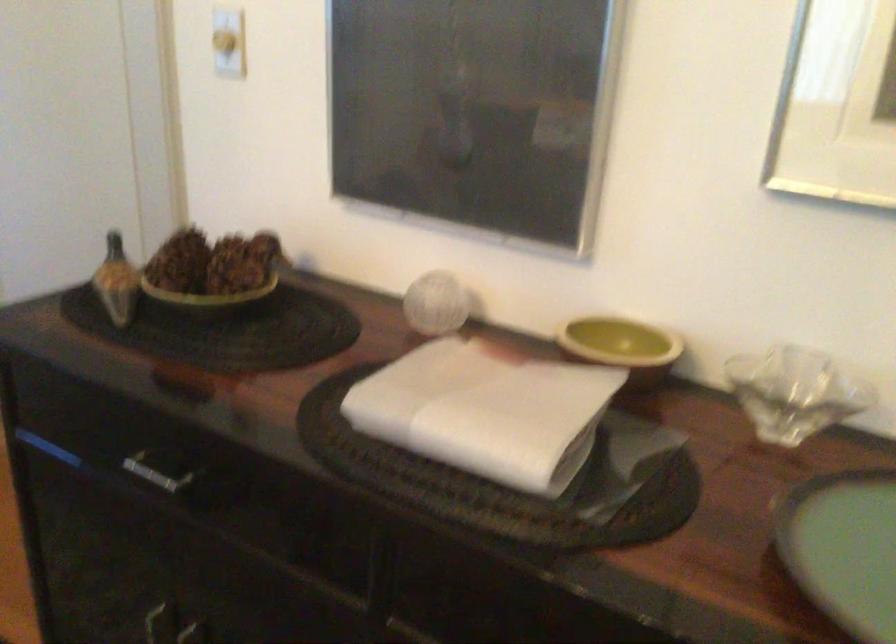
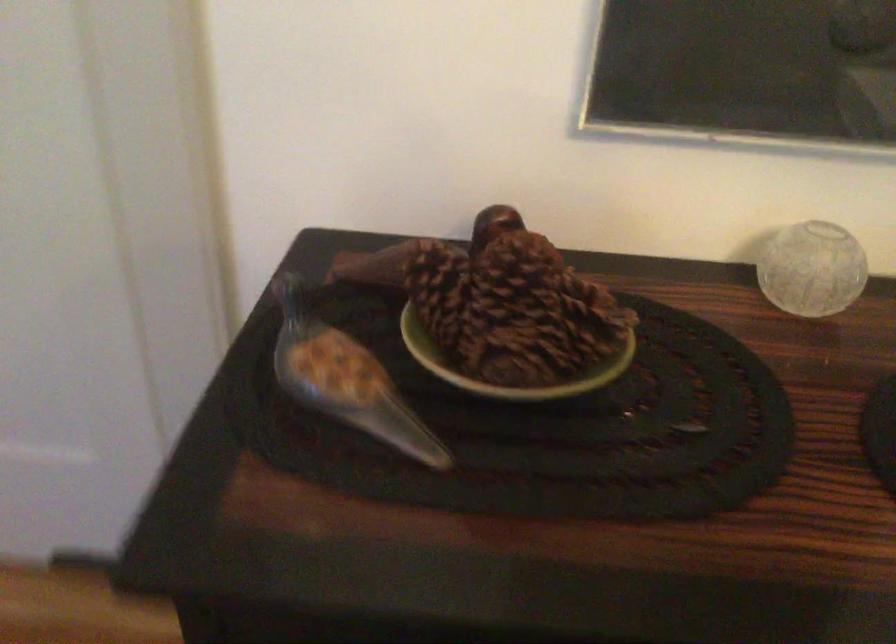
In the second image, find the point that corresponds to point (156, 287) in the first image.

(506, 366)